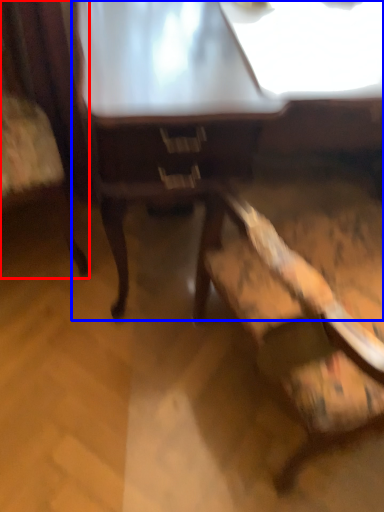
Question: Among these objects, which one is farthest to the camera, chair (highlighted by a red box) or table (highlighted by a blue box)?

Choices:
 (A) chair
 (B) table

Answer: (B)